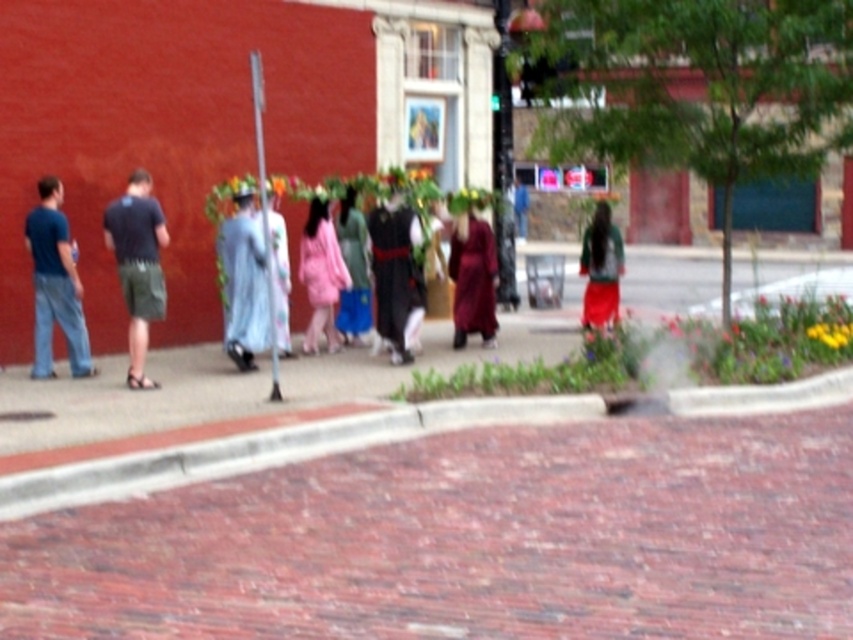
You are standing at the point marked by the coordinates point (469, 540). Looking around, you see the brick pavement at center. Which direction should you walk to reach the sidewalk bordered by the curb?

Since the point 0.844, 0552 corresponds to the brick pavement at center, you are already standing on the sidewalk bordered by the curb. There is no need to move further in any direction.

You are a pedestrian standing on the brick pavement at center. You want to join the group wearing the maroon velvet robe at center. Which direction should you walk to move towards them?

The brick pavement at center is in front of the maroon velvet robe at center, so to reach them you should walk backwards or towards the direction away from the camera since they are behind you.